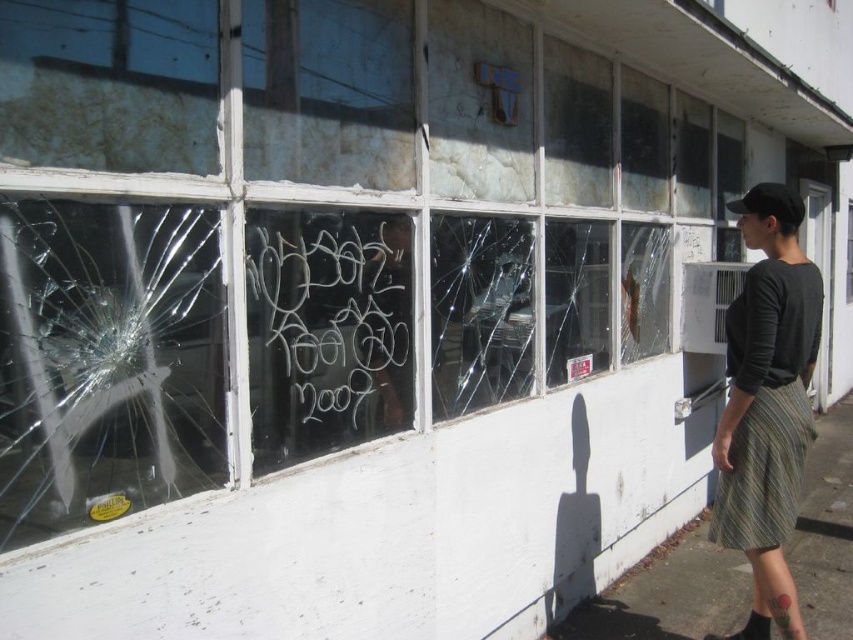
Question: Can you confirm if green striped skirt at right is smaller than clear glass window at center?

Choices:
 (A) yes
 (B) no

Answer: (B)

Question: Can you confirm if green striped skirt at lower right is positioned to the right of clear glass window at center?

Choices:
 (A) yes
 (B) no

Answer: (A)

Question: Which object is closer to the camera taking this photo?

Choices:
 (A) green striped skirt at right
 (B) transparent glass window at center
 (C) clear glass window at center
 (D) green striped skirt at lower right

Answer: (C)

Question: Which point is closer to the camera taking this photo?

Choices:
 (A) (486, 288)
 (B) (827, 541)

Answer: (A)

Question: Which is nearer to the clear glass window at center?

Choices:
 (A) transparent glass window at center
 (B) green striped skirt at right
 (C) green striped skirt at lower right

Answer: (A)

Question: Is green striped skirt at right positioned at the back of clear glass window at center?

Choices:
 (A) no
 (B) yes

Answer: (B)